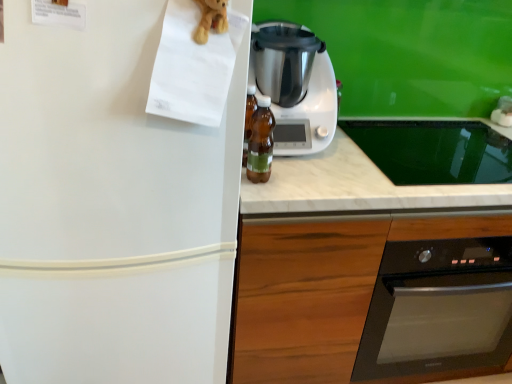
Locate an element on the screen. free spot above wooden at center (from a real-world perspective) is located at coordinates (414, 144).